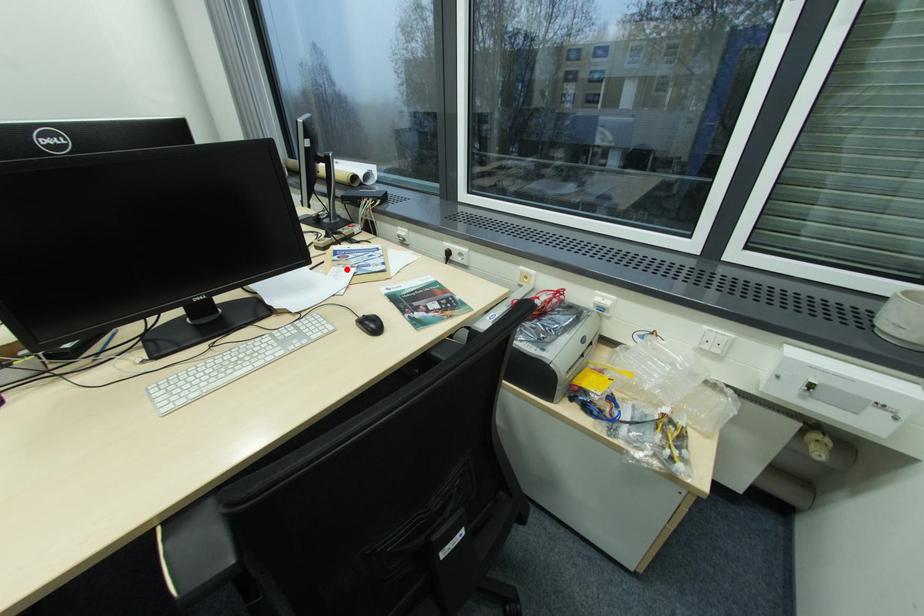
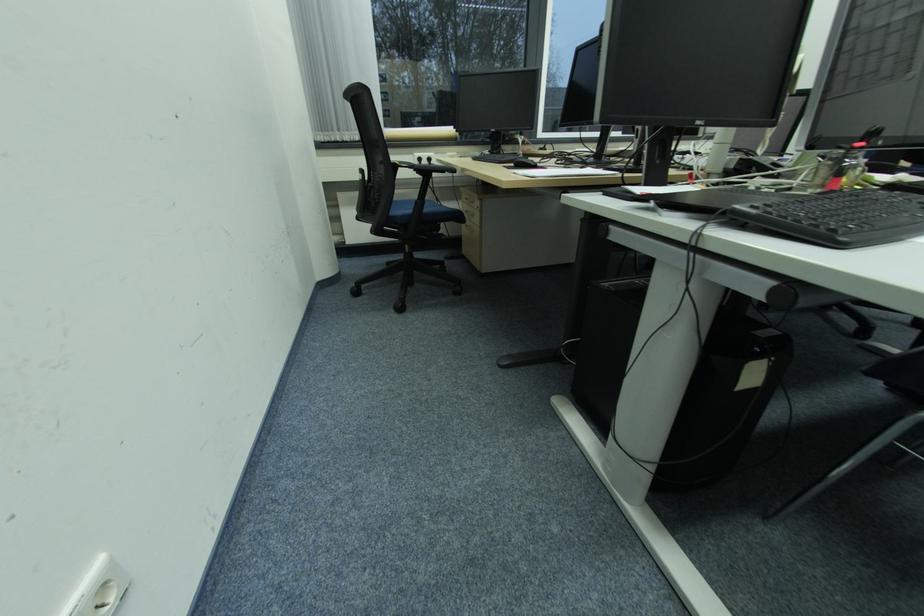
Question: I am providing you with two images of the same scene from different viewpoints. A red point is marked on the first image. Can you still see the location of the red point in image 2?

Choices:
 (A) Yes
 (B) No

Answer: (B)